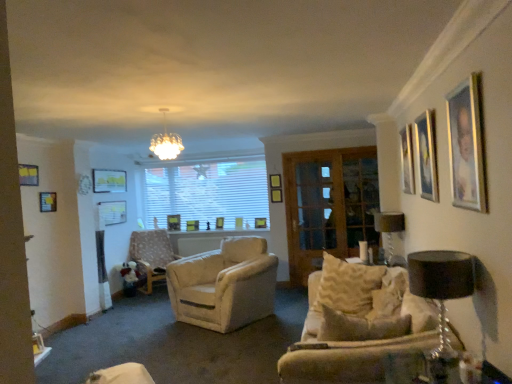
Question: Based on their sizes in the image, would you say wooden picture frame at center, the 11th picture frame positioned from the front, is bigger or smaller than matte gold picture frame at upper right, the third picture frame when ordered from right to left?

Choices:
 (A) big
 (B) small

Answer: (B)

Question: From a real-world perspective, is wooden picture frame at center, the 11th picture frame positioned from the front, above or below matte gold picture frame at upper right, the third picture frame when ordered from right to left?

Choices:
 (A) above
 (B) below

Answer: (B)

Question: Which object is positioned closest to the wooden screen door at center?

Choices:
 (A) black fabric lampshade at right, placed as the 1th lamp when sorted from front to back
 (B) white glass chandelier at upper center
 (C) wooden picture frame at center, the twelfth picture frame positioned from the front
 (D) wooden picture frame at upper left, which is the 4th picture frame in front-to-back order
 (E) wooden picture frame at center, which is counted as the 7th picture frame, starting from the front

Answer: (B)

Question: Estimate the real-world distances between objects in this image. Which object is farther from the wooden picture frame at center, the 5th picture frame in the left-to-right sequence?

Choices:
 (A) wooden picture frame at center, the ninth picture frame viewed from the right
 (B) wooden picture frame at center, marked as the fifth picture frame in a back-to-front arrangement
 (C) wooden picture frame at left, which is counted as the 11th picture frame, starting from the right
 (D) white glass chandelier at upper center
 (E) wooden picture frame at center, which appears as the 6th picture frame when viewed from the right

Answer: (C)